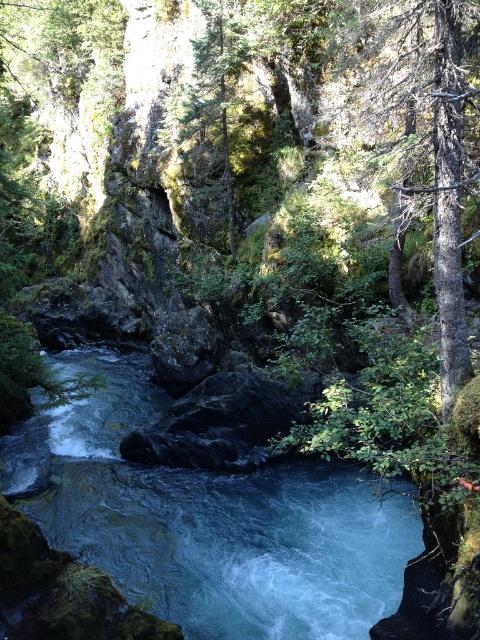
Who is positioned more to the right, smooth bark tree at right or green mossy rock at upper center?

smooth bark tree at right

Between point (433, 248) and point (192, 136), which one is positioned behind?

Point (192, 136)

Does point (455, 340) lie in front of point (199, 140)?

Yes.

Identify the location of smooth bark tree at right. (430, 141).

Who is shorter, blue smooth water at center or smooth bark tree at right?

blue smooth water at center

This screenshot has height=640, width=480. Describe the element at coordinates (208, 518) in the screenshot. I see `blue smooth water at center` at that location.

Is point (410, 552) positioned before point (458, 252)?

No, it is not.

Identify the location of blue smooth water at center. (208, 518).

Is point (159, 564) less distant than point (240, 157)?

Yes, it is in front of point (240, 157).

Does blue smooth water at center appear on the right side of green mossy rock at upper center?

No, blue smooth water at center is not to the right of green mossy rock at upper center.

Locate an element on the screen. The height and width of the screenshot is (640, 480). blue smooth water at center is located at coordinates (208, 518).